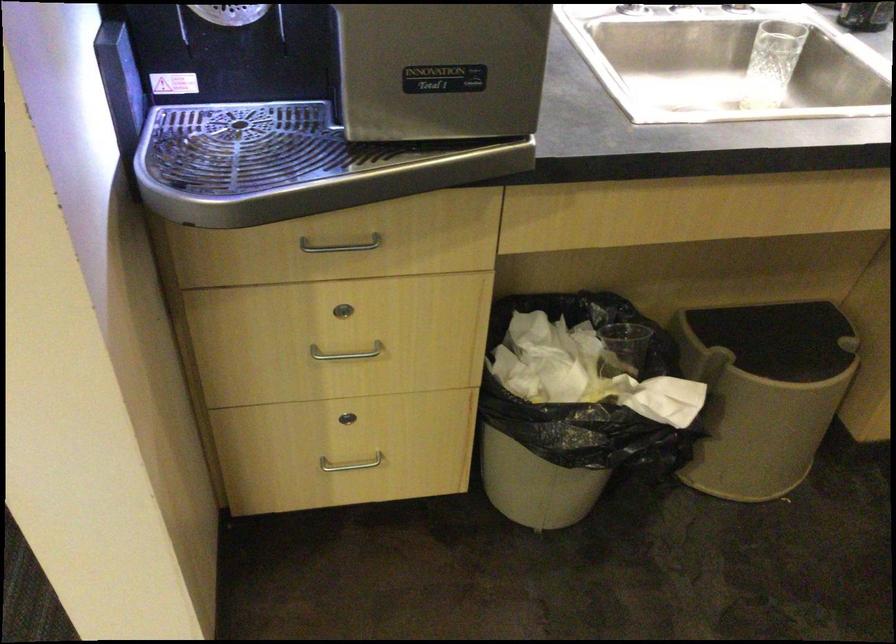
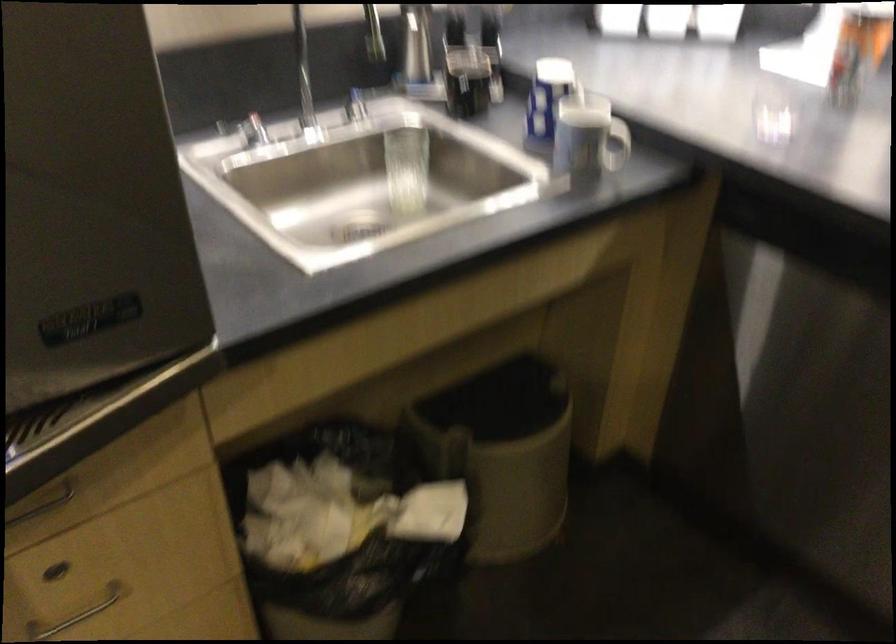
Question: Which direction would the cameraman need to move to produce the second image? Reply with the corresponding letter.

Choices:
 (A) Left
 (B) Right
 (C) Forward
 (D) Backward

Answer: (C)